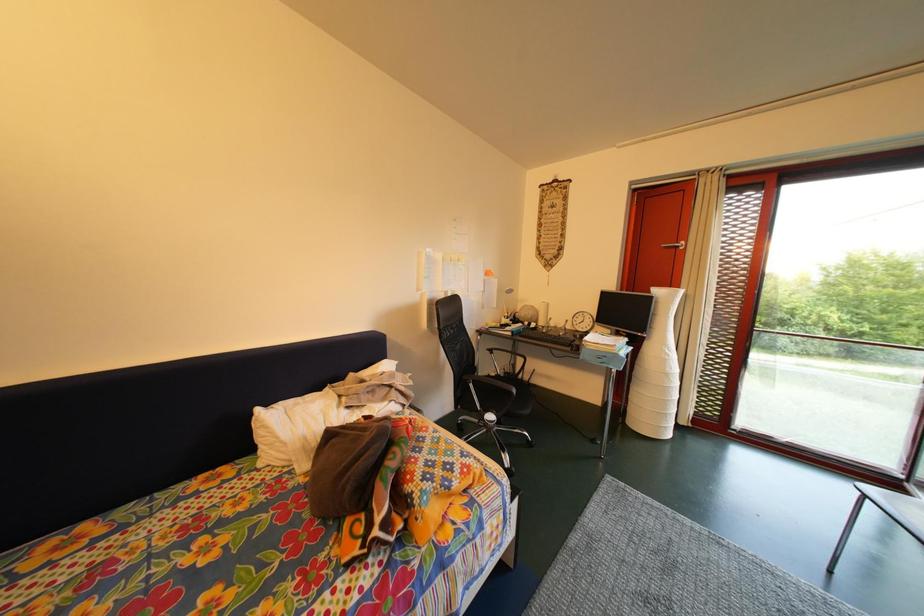
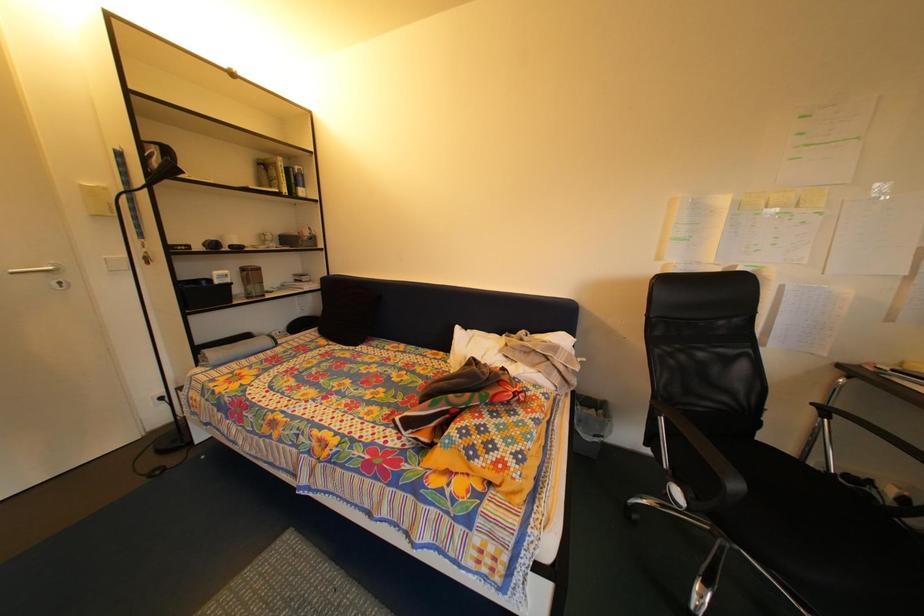
Question: Based on the continuous images, in which direction is the camera rotating? Reply with the corresponding letter.

Choices:
 (A) Left
 (B) Right
 (C) Up
 (D) Down

Answer: (A)